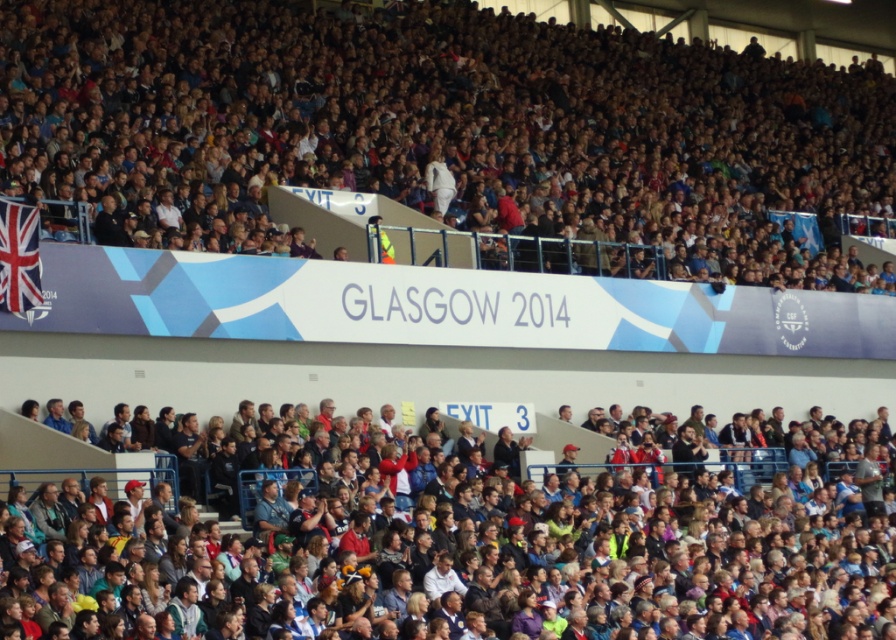
Between matte white banner at upper center and multicolored fabric crowd at lower center, which one appears on the left side from the viewer's perspective?

multicolored fabric crowd at lower center is more to the left.

Who is shorter, matte white banner at upper center or multicolored fabric crowd at lower center?

multicolored fabric crowd at lower center is shorter.

This screenshot has width=896, height=640. I want to click on matte white banner at upper center, so click(445, 125).